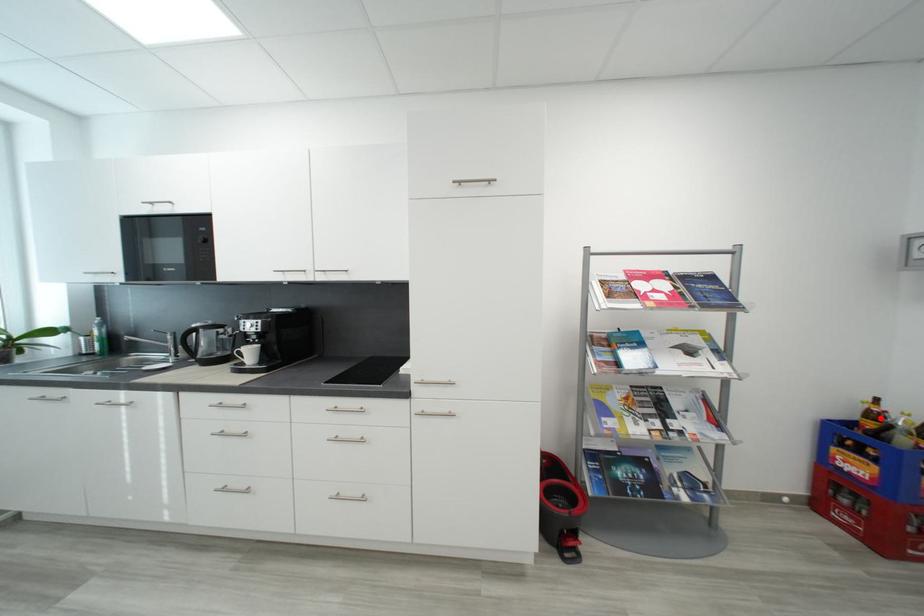
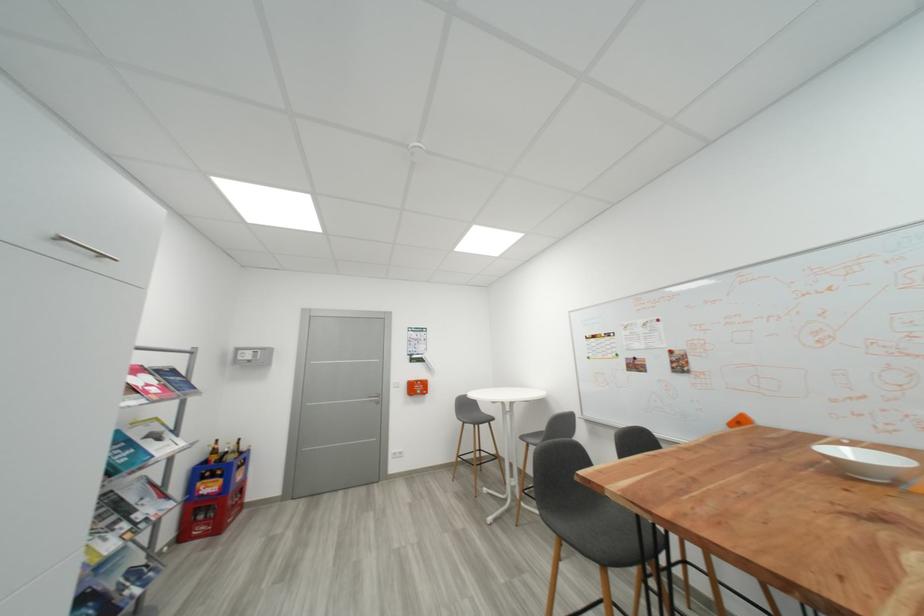
Question: I am providing you with two images of the same scene from different viewpoints. In image1, a red point is highlighted. Considering the same 3D point in image2, which of the following is correct?

Choices:
 (A) It is closer
 (B) It is farther

Answer: (B)